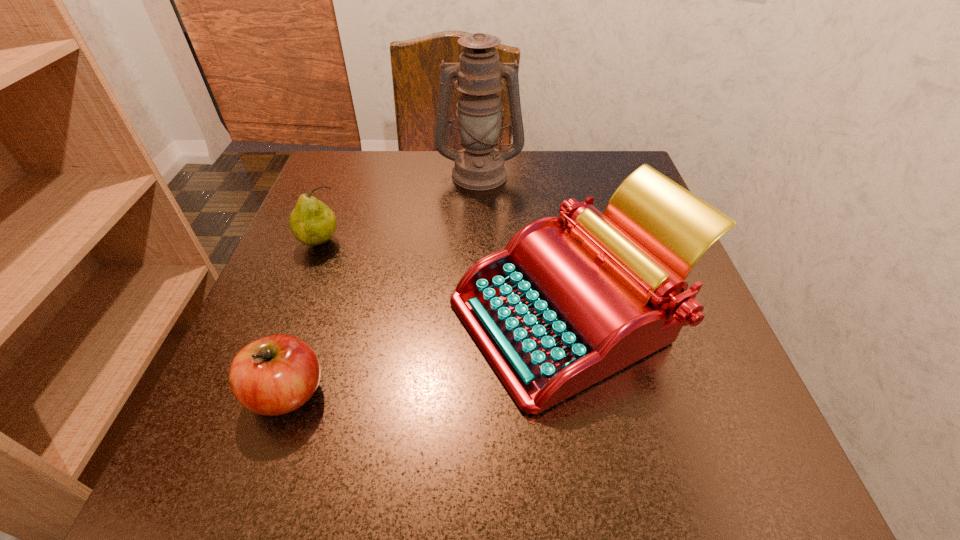
Locate an element on the screen. The height and width of the screenshot is (540, 960). vacant space at the near left corner is located at coordinates pyautogui.click(x=179, y=471).

In order to click on vacant space at the far right corner of the desktop in this screenshot , I will do click(x=598, y=155).

Find the location of a particular element. Image resolution: width=960 pixels, height=540 pixels. free area in between the apple and the oil lamp is located at coordinates (384, 283).

What are the coordinates of `free spot between the apple and the pear` in the screenshot? It's located at (304, 319).

Find the location of `blank region between the pear and the oil lamp`. blank region between the pear and the oil lamp is located at coordinates (400, 208).

The width and height of the screenshot is (960, 540). I want to click on vacant point located between the apple and the third shortest object, so click(x=430, y=354).

The height and width of the screenshot is (540, 960). Find the location of `blank region between the pear and the apple`. blank region between the pear and the apple is located at coordinates (304, 319).

You are a GUI agent. You are given a task and a screenshot of the screen. Output one action in this format:
    pyautogui.click(x=<x>, y=<y>)
    Task: Click on the vacant area between the second tallest object and the apple
    
    Given the screenshot: What is the action you would take?
    pyautogui.click(x=430, y=354)

The width and height of the screenshot is (960, 540). Find the location of `free spot between the tallest object and the apple`. free spot between the tallest object and the apple is located at coordinates (384, 283).

Locate an element on the screen. The width and height of the screenshot is (960, 540). object that is the second closest to the apple is located at coordinates (312, 223).